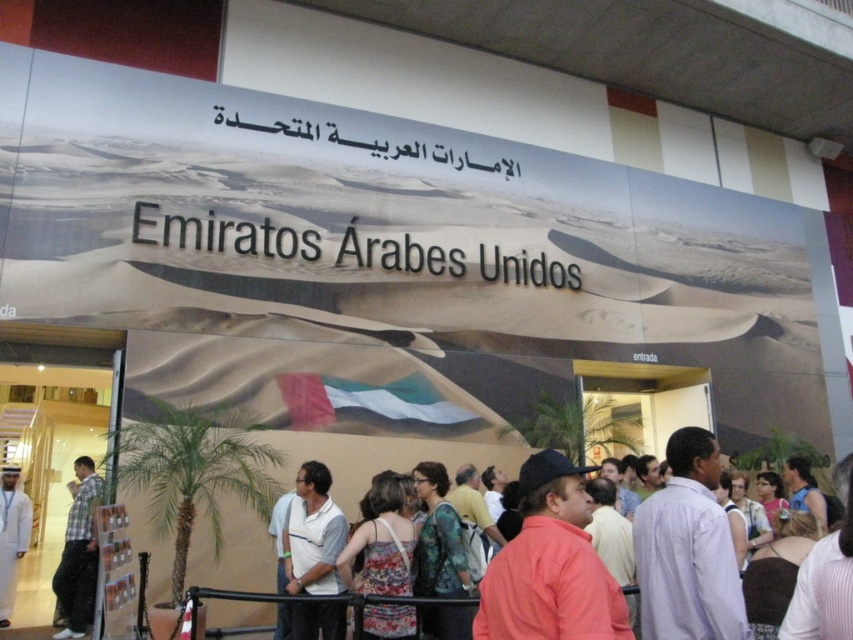
You are at an event about the United Arab Emirates and need to locate the black metallic sign at center. According to the scene description, where would you find it?

The black metallic sign at center is located at point (347, 248).

You are at the exhibition and need to read the text on the black metallic sign at center. However, there is a white fabric at center in front of it. Can you still see the sign clearly?

The black metallic sign at center has a lesser height compared to white fabric at center, so the white fabric at center is taller and may block the view of the sign. Therefore, you might not be able to see the sign clearly.